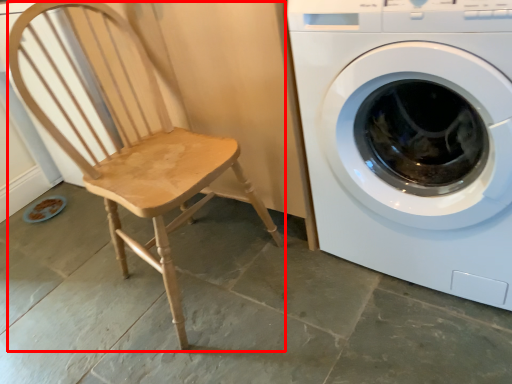
Question: From the image's perspective, where is rocking chair (annotated by the red box) located relative to washing machine?

Choices:
 (A) above
 (B) below

Answer: (B)